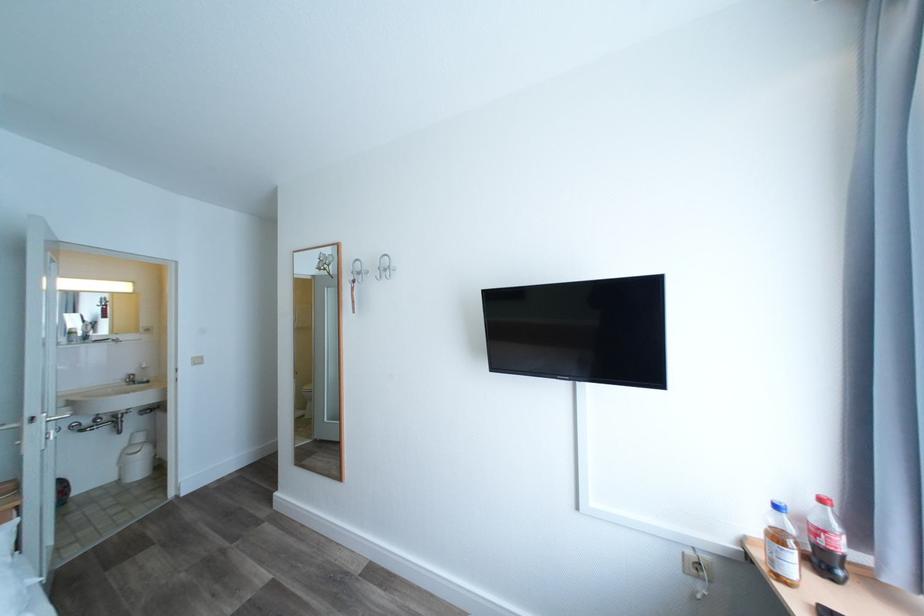
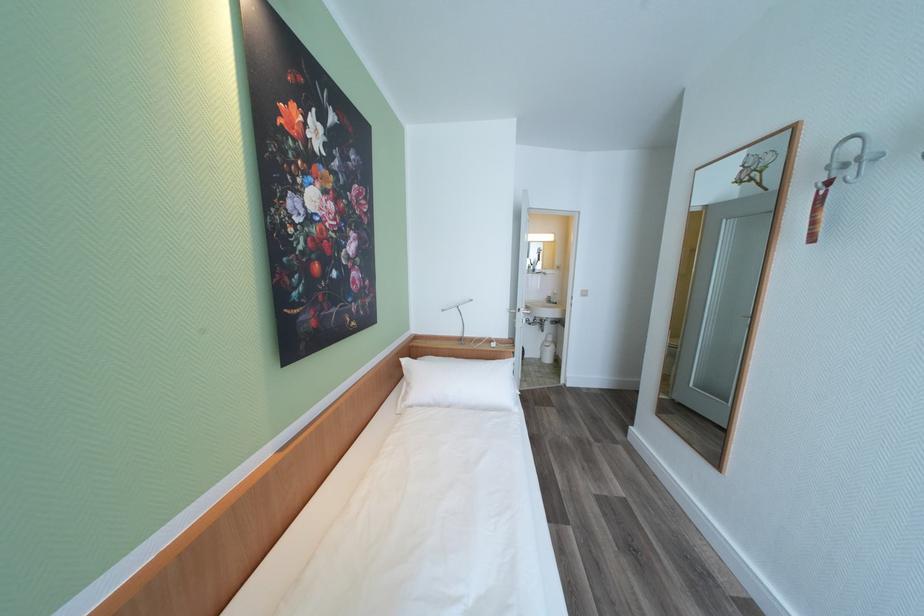
Locate, in the second image, the point that corresponds to point 123,480 in the first image.

(546, 359)